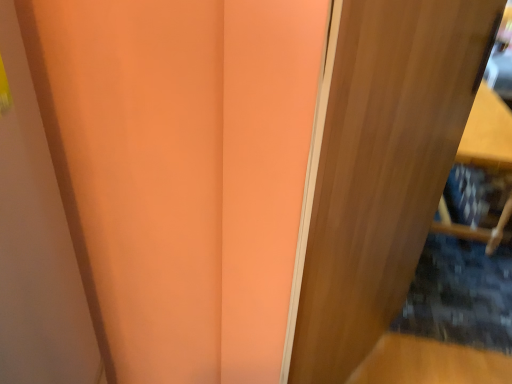
Question: Is wooden door at right wider or thinner than wooden shelf at right?

Choices:
 (A) thin
 (B) wide

Answer: (A)

Question: Relative to wooden shelf at right, is wooden door at right in front or behind?

Choices:
 (A) front
 (B) behind

Answer: (A)

Question: Do you think wooden door at right is within wooden shelf at right, or outside of it?

Choices:
 (A) outside
 (B) inside

Answer: (A)

Question: Do you think wooden shelf at right is within wooden door at right, or outside of it?

Choices:
 (A) outside
 (B) inside

Answer: (A)

Question: Considering the relative positions of wooden shelf at right and wooden door at right in the image provided, is wooden shelf at right to the left or to the right of wooden door at right?

Choices:
 (A) right
 (B) left

Answer: (A)

Question: Considering their positions, is wooden shelf at right located in front of or behind wooden door at right?

Choices:
 (A) behind
 (B) front

Answer: (A)

Question: Based on their sizes in the image, would you say wooden shelf at right is bigger or smaller than wooden door at right?

Choices:
 (A) big
 (B) small

Answer: (A)